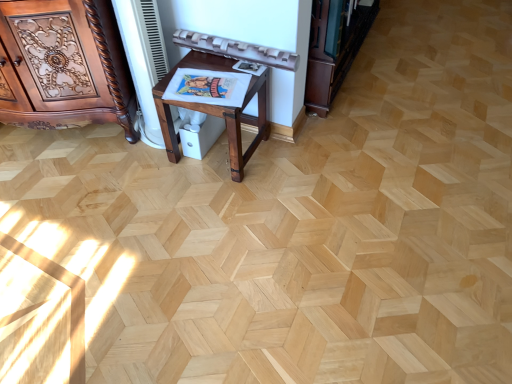
I want to click on vacant region below polished wood cabinet at left (from a real-world perspective), so point(72,135).